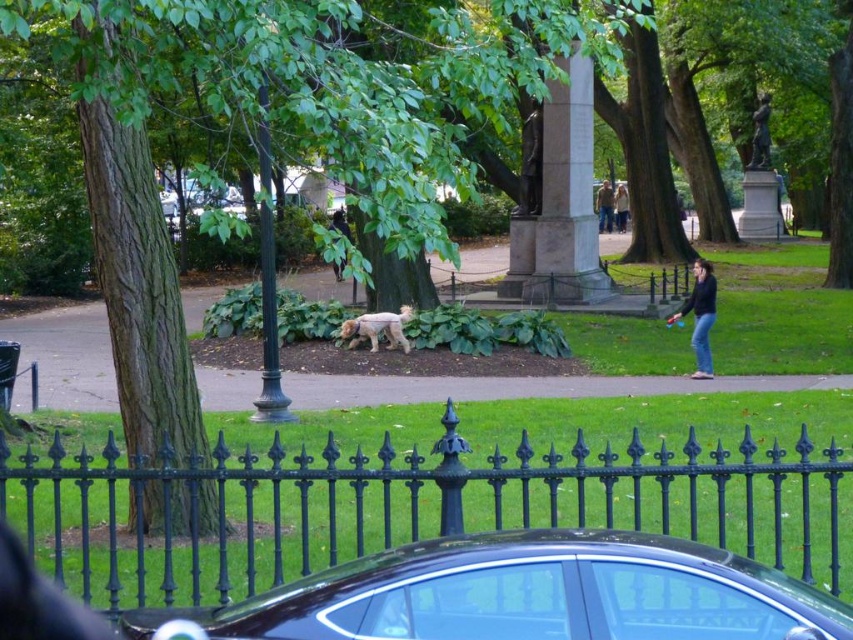
Question: Which of the following is the closest to the observer?

Choices:
 (A) (602, 208)
 (B) (706, 301)
 (C) (303, 529)
 (D) (624, 224)

Answer: (C)

Question: Is black wrought iron fence at center bigger than brown leather jacket at center?

Choices:
 (A) yes
 (B) no

Answer: (B)

Question: Is shiny black car at lower center above dark brown leather jacket at center?

Choices:
 (A) yes
 (B) no

Answer: (B)

Question: Is light brown fur dog at center below brown leather jacket at center?

Choices:
 (A) no
 (B) yes

Answer: (B)

Question: Which point is farther to the camera?

Choices:
 (A) dark brown leather jacket at center
 (B) shiny black car at lower center
 (C) brown leather jacket at center

Answer: (A)

Question: Among these points, which one is nearest to the camera?

Choices:
 (A) (706, 330)
 (B) (605, 204)
 (C) (618, 189)

Answer: (A)